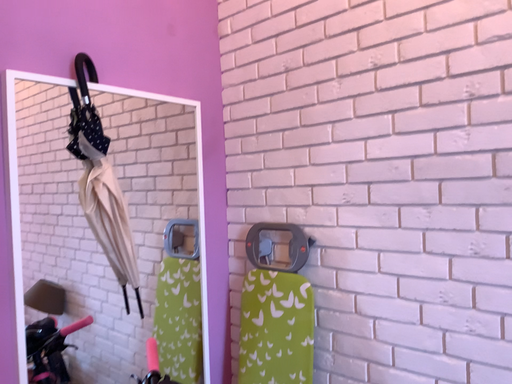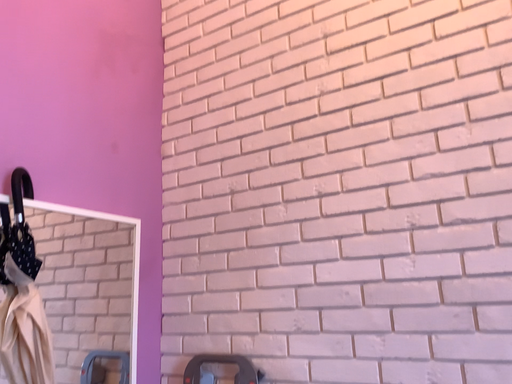
Question: How did the camera likely rotate when shooting the video?

Choices:
 (A) rotated upward
 (B) rotated downward

Answer: (A)